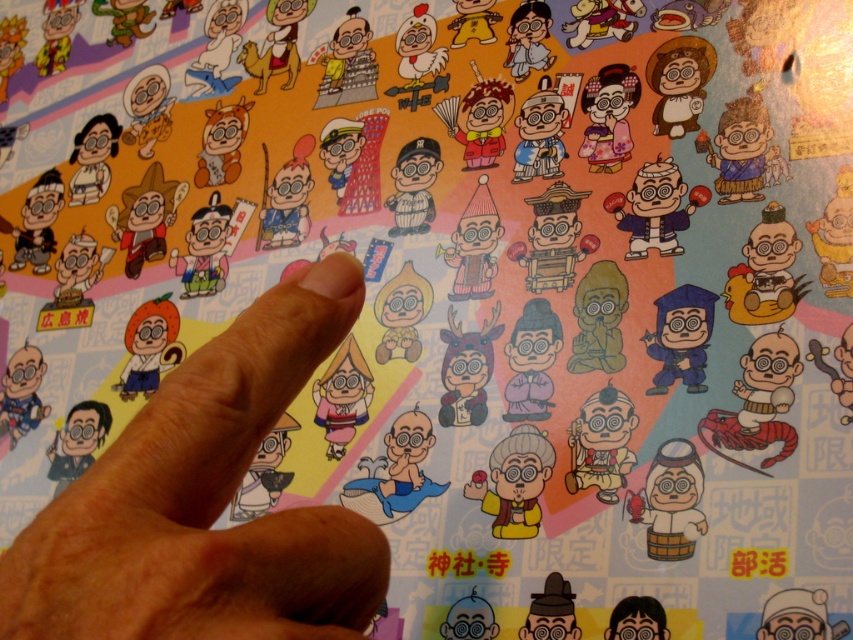
Can you confirm if brown skin at center is thinner than blue matte graduation cap at lower right?

No.

Between brown skin at center and blue matte graduation cap at lower right, which one is positioned lower?

brown skin at center

Who is more distant from viewer, (126, 556) or (674, 349)?

The point (674, 349) is behind.

Where is `brown skin at center`? brown skin at center is located at coordinates (206, 500).